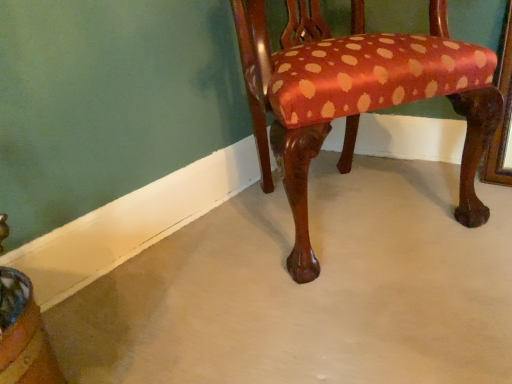
The image size is (512, 384). What do you see at coordinates (355, 97) in the screenshot? I see `polished wood chair at center` at bounding box center [355, 97].

At what (x,y) coordinates should I click in order to perform the action: click on polished wood chair at center. Please return your answer as a coordinate pair (x, y). This screenshot has width=512, height=384. Looking at the image, I should click on (355, 97).

Identify the location of polished wood chair at center. This screenshot has width=512, height=384. (355, 97).